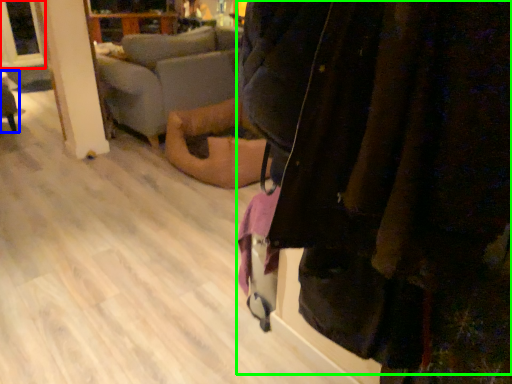
Question: Which object is the farthest from window screen (highlighted by a red box)? Choose among these: furniture (highlighted by a blue box) or jacket (highlighted by a green box).

Choices:
 (A) furniture
 (B) jacket

Answer: (B)